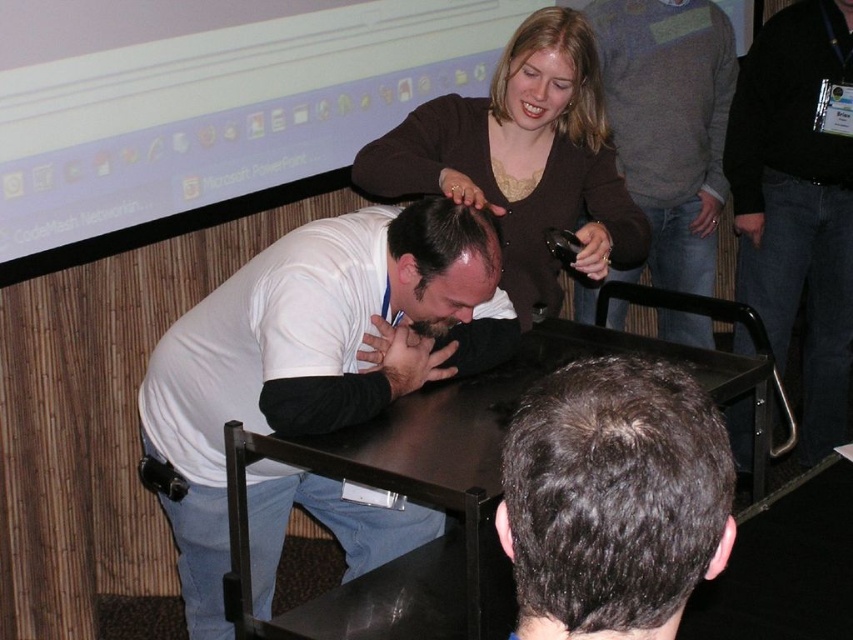
Between matte plastic projector screen at upper center and gray sweater at upper center, which one has less height?

matte plastic projector screen at upper center is shorter.

Is matte plastic projector screen at upper center above gray sweater at upper center?

Yes.

Locate an element on the screen. The height and width of the screenshot is (640, 853). matte plastic projector screen at upper center is located at coordinates (219, 120).

Where is `matte plastic projector screen at upper center`? matte plastic projector screen at upper center is located at coordinates (219, 120).

Describe the element at coordinates (312, 355) in the screenshot. I see `white matte shirt at center` at that location.

Is white matte shirt at center smaller than brown sweater at upper center?

No.

Between point (485, 236) and point (521, 214), which one is positioned in front?

Point (485, 236)

Identify the location of white matte shirt at center. (312, 355).

Consider the image. Does dark brown hair at center have a lesser width compared to black glossy table at center?

Yes.

The image size is (853, 640). Identify the location of dark brown hair at center. (613, 499).

The width and height of the screenshot is (853, 640). What are the coordinates of `dark brown hair at center` in the screenshot? It's located at (613, 499).